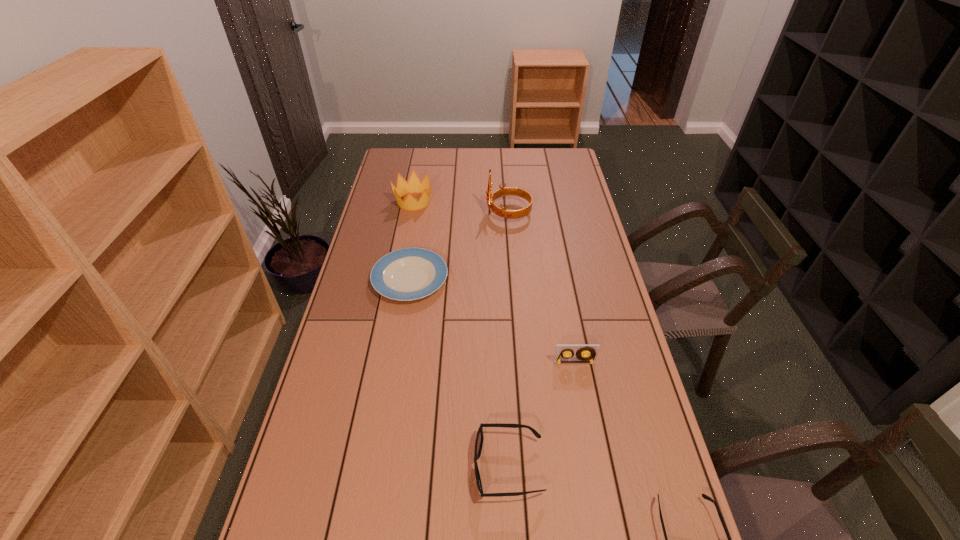
The image size is (960, 540). In order to click on the left sunglasses in this screenshot , I will do `click(479, 438)`.

The image size is (960, 540). I want to click on the taller sunglasses, so click(479, 438).

In order to click on the fifth shortest object in this screenshot , I will do `click(414, 185)`.

Where is `the fourth shortest object`? the fourth shortest object is located at coordinates (564, 353).

Identify the location of the fourth farthest object. The width and height of the screenshot is (960, 540). (564, 353).

This screenshot has height=540, width=960. I want to click on the tallest object, so [x=503, y=191].

Where is `the fourth nearest object`? The height and width of the screenshot is (540, 960). the fourth nearest object is located at coordinates (407, 274).

The image size is (960, 540). In order to click on plate in this screenshot , I will do `click(407, 274)`.

Image resolution: width=960 pixels, height=540 pixels. Identify the location of blank area located on the front-facing side of the left sunglasses. (454, 467).

Locate an element on the screen. The image size is (960, 540). free space located on the front-facing side of the left sunglasses is located at coordinates (332, 467).